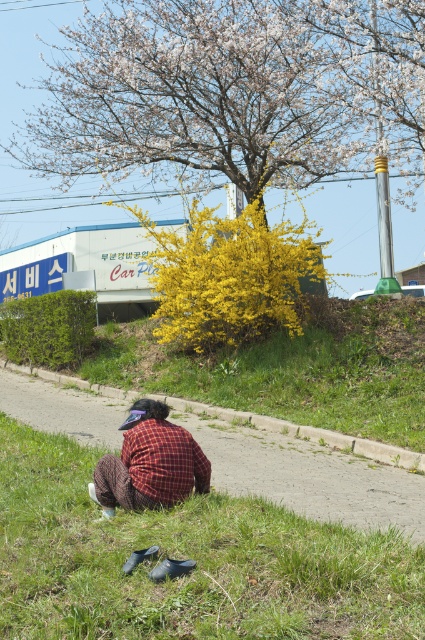
Question: Can you confirm if green grass at lower center is thinner than gray concrete pavement at lower center?

Choices:
 (A) no
 (B) yes

Answer: (B)

Question: Is fluffy white blossoms at upper center in front of plaid fabric shirt at lower center?

Choices:
 (A) no
 (B) yes

Answer: (A)

Question: Can you confirm if green grass at lower center is positioned to the left of plaid fabric shirt at lower center?

Choices:
 (A) no
 (B) yes

Answer: (A)

Question: Which point is farther to the camera?

Choices:
 (A) coord(218,147)
 (B) coord(153,486)
 (C) coord(325,541)

Answer: (A)

Question: Among these points, which one is farthest from the camera?

Choices:
 (A) (231, 484)
 (B) (206, 136)
 (C) (249, 570)

Answer: (B)

Question: Which object is closer to the camera taking this photo?

Choices:
 (A) fluffy white blossoms at upper center
 (B) green grass at lower center
 (C) plaid fabric shirt at lower center
 (D) gray concrete pavement at lower center

Answer: (B)